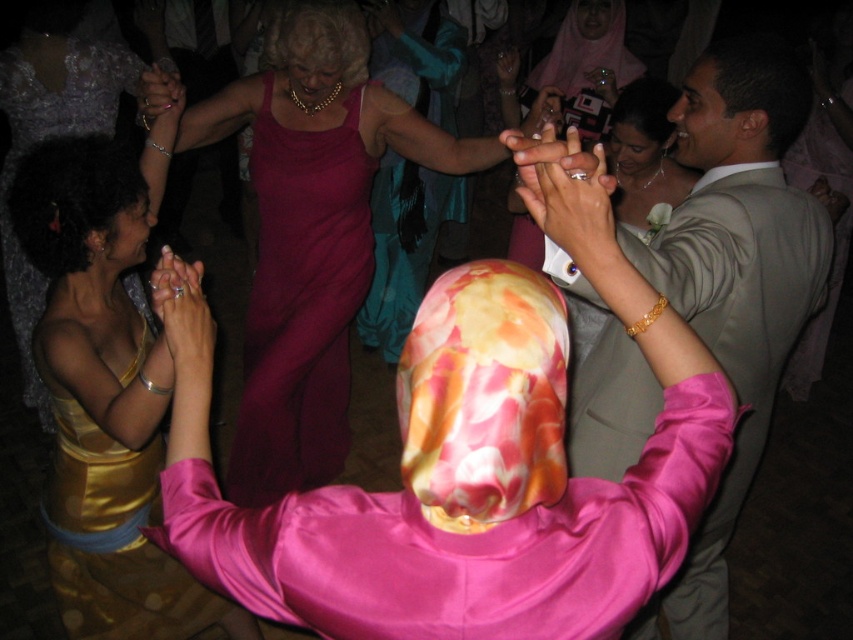
Can you confirm if matte pink dress at center is taller than gold satin dress at center?

Indeed, matte pink dress at center has a greater height compared to gold satin dress at center.

Describe the element at coordinates (311, 234) in the screenshot. This screenshot has width=853, height=640. I see `matte pink dress at center` at that location.

Who is more forward, (408, 108) or (83, 484)?

Point (83, 484)

Locate an element on the screen. This screenshot has height=640, width=853. matte pink dress at center is located at coordinates (311, 234).

Which is more to the right, matte beige suit at center or gold satin dress at center?

matte beige suit at center is more to the right.

Is matte beige suit at center closer to camera compared to gold satin dress at center?

Yes, matte beige suit at center is in front of gold satin dress at center.

Is point (814, 266) positioned in front of point (39, 205)?

No, it is not.

This screenshot has width=853, height=640. What are the coordinates of `matte beige suit at center` in the screenshot? It's located at (735, 276).

Who is positioned more to the left, gold satin dress at center or matte magenta gown at center?

gold satin dress at center

The image size is (853, 640). What do you see at coordinates (103, 394) in the screenshot?
I see `gold satin dress at center` at bounding box center [103, 394].

The height and width of the screenshot is (640, 853). I want to click on gold satin dress at center, so click(103, 394).